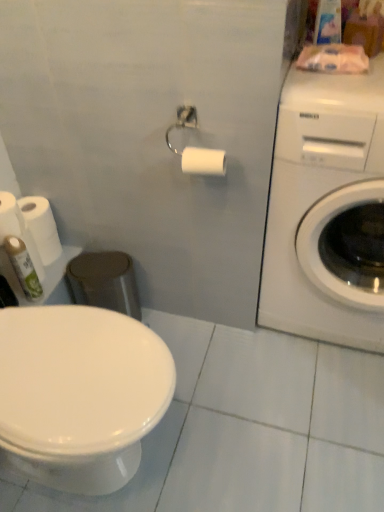
Describe the element at coordinates (18, 229) in the screenshot. I see `white matte toilet paper at left, acting as the third toilet paper starting from the front` at that location.

Describe the element at coordinates (23, 268) in the screenshot. I see `green matte spray can at lower left` at that location.

This screenshot has height=512, width=384. What are the coordinates of `white matte toilet paper at upper center, the fourth toilet paper when ordered from back to front` in the screenshot? It's located at (203, 161).

Find the location of a particular element. Image resolution: width=384 pixels, height=512 pixels. white glossy toilet at lower left is located at coordinates (80, 394).

Where is `toilet paper that is the 2nd object located above the white matte toilet paper at left, arranged as the second toilet paper when viewed from the back (from the image's perspective)`? The image size is (384, 512). toilet paper that is the 2nd object located above the white matte toilet paper at left, arranged as the second toilet paper when viewed from the back (from the image's perspective) is located at coordinates (10, 217).

From the picture: From the image's perspective, which is above, white matte toilet paper at left, acting as the third toilet paper starting from the front, or white matte toilet paper at left, the fourth toilet paper viewed from the right?

white matte toilet paper at left, the fourth toilet paper viewed from the right.

From their relative heights in the image, would you say white matte toilet paper at left, placed as the 3th toilet paper when sorted from right to left, is taller or shorter than white matte toilet paper at left, which appears as the third toilet paper when viewed from the back?

In the image, white matte toilet paper at left, placed as the 3th toilet paper when sorted from right to left, appears to be shorter than white matte toilet paper at left, which appears as the third toilet paper when viewed from the back.

Could you tell me if white matte toilet paper at left, which is counted as the second toilet paper, starting from the left, is facing white matte toilet paper at left, the fourth toilet paper viewed from the right?

No, white matte toilet paper at left, which is counted as the second toilet paper, starting from the left, does not turn towards white matte toilet paper at left, the fourth toilet paper viewed from the right.

Which object is wider, white glossy toilet at lower left or white glossy washing machine at upper right?

white glossy washing machine at upper right.

Is white glossy toilet at lower left spatially inside white glossy washing machine at upper right, or outside of it?

The correct answer is: outside.

Does point (64, 490) come behind point (306, 180)?

That is True.

Is there a large distance between white matte toilet paper at left, acting as the third toilet paper starting from the front, and green matte spray can at lower left?

No.

Between white matte toilet paper at left, arranged as the second toilet paper when viewed from the back, and green matte spray can at lower left, which one has smaller size?

green matte spray can at lower left.

Which point is more distant from viewer, (29, 237) or (15, 263)?

The point (15, 263) is behind.

From the image's perspective, which one is positioned higher, white matte toilet paper at left, placed as the 3th toilet paper when sorted from right to left, or green matte spray can at lower left?

From the image's view, white matte toilet paper at left, placed as the 3th toilet paper when sorted from right to left, is above.

Which is more to the left, green matte spray can at lower left or white glossy washing machine at upper right?

green matte spray can at lower left is more to the left.

Is green matte spray can at lower left surrounding white glossy washing machine at upper right?

Definitely not — white glossy washing machine at upper right is not inside green matte spray can at lower left.

Which of these two, green matte spray can at lower left or white glossy washing machine at upper right, is thinner?

Thinner between the two is green matte spray can at lower left.

Which of these two, green matte spray can at lower left or white glossy washing machine at upper right, stands taller?

white glossy washing machine at upper right is taller.

Considering the relative sizes of green matte spray can at lower left and white matte toilet paper at left, the third toilet paper from the left, in the image provided, is green matte spray can at lower left bigger than white matte toilet paper at left, the third toilet paper from the left,?

Actually, green matte spray can at lower left might be smaller than white matte toilet paper at left, the third toilet paper from the left.

Is green matte spray can at lower left located outside white matte toilet paper at left, the first toilet paper from the back?

Absolutely, green matte spray can at lower left is external to white matte toilet paper at left, the first toilet paper from the back.

Is green matte spray can at lower left oriented towards white matte toilet paper at left, the first toilet paper from the back?

No.

In the scene shown: Does green matte spray can at lower left appear on the left side of white matte toilet paper at left, the 2th toilet paper viewed from the right?

No, green matte spray can at lower left is not to the left of white matte toilet paper at left, the 2th toilet paper viewed from the right.

Considering the relative positions of white matte toilet paper at left, the fourth toilet paper viewed from the right, and white glossy toilet at lower left in the image provided, is white matte toilet paper at left, the fourth toilet paper viewed from the right, to the right of white glossy toilet at lower left from the viewer's perspective?

No.

In terms of width, does white matte toilet paper at left, which appears as the third toilet paper when viewed from the back, look wider or thinner when compared to white glossy toilet at lower left?

In the image, white matte toilet paper at left, which appears as the third toilet paper when viewed from the back, appears to be more narrow than white glossy toilet at lower left.

At what (x,y) coordinates should I click in order to perform the action: click on toilet below the white matte toilet paper at left, which appears as the third toilet paper when viewed from the back (from the image's perspective). Please return your answer as a coordinate pair (x, y). Looking at the image, I should click on (x=80, y=394).

Which of these two, white glossy toilet at lower left or green matte spray can at lower left, is thinner?

green matte spray can at lower left is thinner.

The width and height of the screenshot is (384, 512). I want to click on toilet on the right side of green matte spray can at lower left, so click(x=80, y=394).

Who is bigger, white glossy toilet at lower left or green matte spray can at lower left?

white glossy toilet at lower left is bigger.

In the image, is white glossy toilet at lower left on the left side or the right side of green matte spray can at lower left?

Based on their positions, white glossy toilet at lower left is located to the right of green matte spray can at lower left.

Locate an element on the screen. The height and width of the screenshot is (512, 384). toilet paper that is the 1st object located behind the white matte toilet paper at left, which appears as the third toilet paper when viewed from the back is located at coordinates (18, 229).

Where is `washing machine lying above the white glossy toilet at lower left (from the image's perspective)`? washing machine lying above the white glossy toilet at lower left (from the image's perspective) is located at coordinates (327, 210).

From the image, which object appears to be farther from white glossy toilet at lower left, white glossy washing machine at upper right or white matte toilet paper at left, the third toilet paper from the left?

Based on the image, white glossy washing machine at upper right appears to be further to white glossy toilet at lower left.

Based on their spatial positions, is white matte toilet paper at left, the fourth toilet paper viewed from the right, or white matte toilet paper at left, which is counted as the second toilet paper, starting from the left, further from white matte toilet paper at upper center, the 1th toilet paper positioned from the right?

Among the two, white matte toilet paper at left, the fourth toilet paper viewed from the right, is located further to white matte toilet paper at upper center, the 1th toilet paper positioned from the right.

Looking at the image, which one is located further to white matte toilet paper at upper center, which ranks as the 4th toilet paper in left-to-right order, white matte toilet paper at left, placed as the 3th toilet paper when sorted from right to left, or white matte toilet paper at left, which ranks as the second toilet paper in front-to-back order?

Among the two, white matte toilet paper at left, which ranks as the second toilet paper in front-to-back order, is located further to white matte toilet paper at upper center, which ranks as the 4th toilet paper in left-to-right order.

From the image, which object appears to be nearer to white matte toilet paper at left, the 2th toilet paper viewed from the right, white glossy toilet at lower left or white glossy washing machine at upper right?

The object closer to white matte toilet paper at left, the 2th toilet paper viewed from the right, is white glossy toilet at lower left.

Estimate the real-world distances between objects in this image. Which object is closer to white glossy toilet at lower left, white glossy washing machine at upper right or white matte toilet paper at left, which ranks as the second toilet paper in front-to-back order?

The object closer to white glossy toilet at lower left is white matte toilet paper at left, which ranks as the second toilet paper in front-to-back order.

Estimate the real-world distances between objects in this image. Which object is further from white matte toilet paper at upper center, positioned as the first toilet paper in front-to-back order, white matte toilet paper at left, which ranks as the second toilet paper in front-to-back order, or green matte spray can at lower left?

The object further to white matte toilet paper at upper center, positioned as the first toilet paper in front-to-back order, is green matte spray can at lower left.

Looking at the image, which one is located closer to white glossy toilet at lower left, white matte toilet paper at left, arranged as the second toilet paper when viewed from the back, or white glossy washing machine at upper right?

Among the two, white matte toilet paper at left, arranged as the second toilet paper when viewed from the back, is located nearer to white glossy toilet at lower left.

Based on their spatial positions, is white glossy toilet at lower left or white matte toilet paper at left, the third toilet paper from the left, further from white matte toilet paper at left, acting as the third toilet paper starting from the front?

white glossy toilet at lower left is further to white matte toilet paper at left, acting as the third toilet paper starting from the front.

I want to click on toilet between white matte toilet paper at left, which is the 1th toilet paper in left-to-right order, and white glossy washing machine at upper right from left to right, so click(x=80, y=394).

This screenshot has width=384, height=512. Identify the location of toilet paper between green matte spray can at lower left and white matte toilet paper at left, the first toilet paper from the back, from front to back. (18, 229).

The height and width of the screenshot is (512, 384). I want to click on toiletry situated between white matte toilet paper at left, the third toilet paper from the left, and white glossy washing machine at upper right from left to right, so click(x=23, y=268).

At what (x,y) coordinates should I click in order to perform the action: click on toilet paper situated between white matte toilet paper at left, arranged as the second toilet paper when viewed from the back, and white matte toilet paper at upper center, the fourth toilet paper when ordered from back to front, from left to right. Please return your answer as a coordinate pair (x, y). Image resolution: width=384 pixels, height=512 pixels. Looking at the image, I should click on (41, 227).